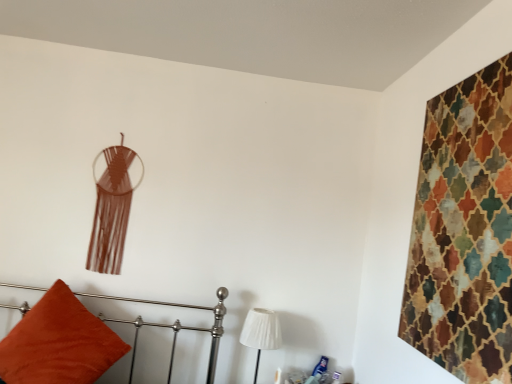
Question: Relative to white pleated fabric at lower center, is textured multicolored tapestry at upper right in front or behind?

Choices:
 (A) front
 (B) behind

Answer: (A)

Question: From the image's perspective, relative to white pleated fabric at lower center, is textured multicolored tapestry at upper right above or below?

Choices:
 (A) below
 (B) above

Answer: (B)

Question: Estimate the real-world distances between objects in this image. Which object is closer to the white pleated fabric at lower center?

Choices:
 (A) velvet orange pillow at lower left
 (B) textured multicolored tapestry at upper right

Answer: (A)

Question: Which of these objects is positioned closest to the white pleated fabric at lower center?

Choices:
 (A) textured multicolored tapestry at upper right
 (B) velvet orange pillow at lower left

Answer: (B)